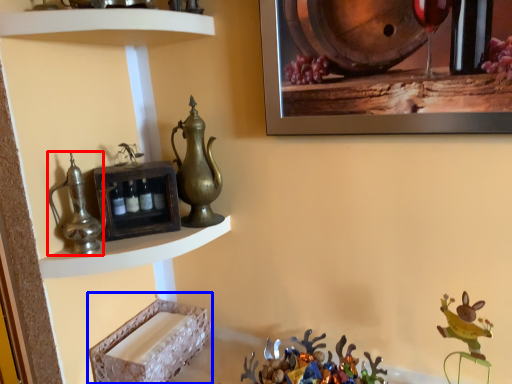
Question: Which of the following is the farthest to the observer, jug (highlighted by a red box) or shelf (highlighted by a blue box)?

Choices:
 (A) jug
 (B) shelf

Answer: (B)